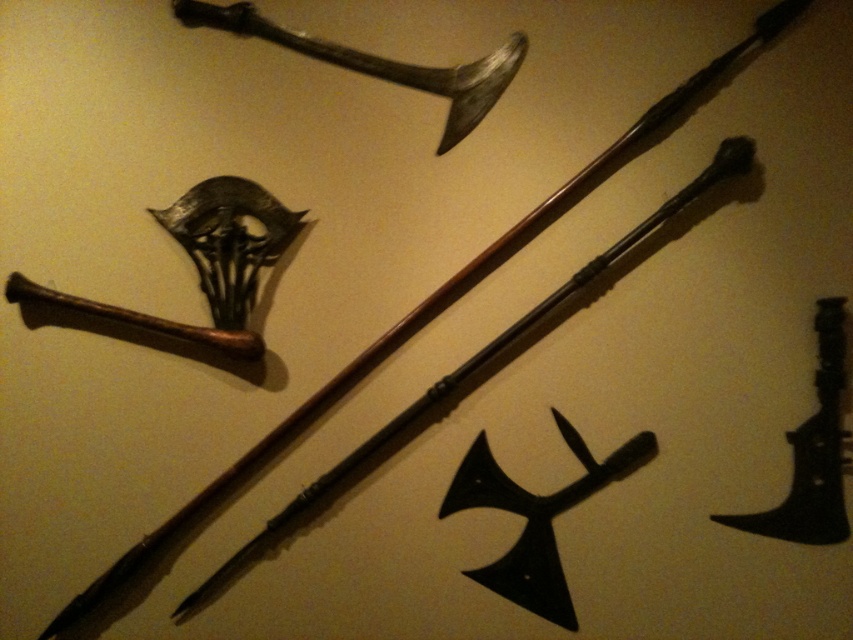
Question: Does black matte axe at center have a lesser width compared to black metal axe at lower right?

Choices:
 (A) yes
 (B) no

Answer: (B)

Question: Is black matte axe at center above dark brown wooden sword at upper center?

Choices:
 (A) yes
 (B) no

Answer: (B)

Question: Among these points, which one is nearest to the camera?

Choices:
 (A) (404, 84)
 (B) (798, 465)
 (C) (625, 474)

Answer: (B)

Question: Among these points, which one is nearest to the camera?

Choices:
 (A) (683, 204)
 (B) (461, 68)
 (C) (515, 602)

Answer: (A)

Question: Is black matte axe at center positioned behind black metal axe at lower right?

Choices:
 (A) yes
 (B) no

Answer: (A)

Question: Which of the following is the closest to the observer?

Choices:
 (A) dark brown wooden sword at upper center
 (B) black metal axe at lower right

Answer: (B)